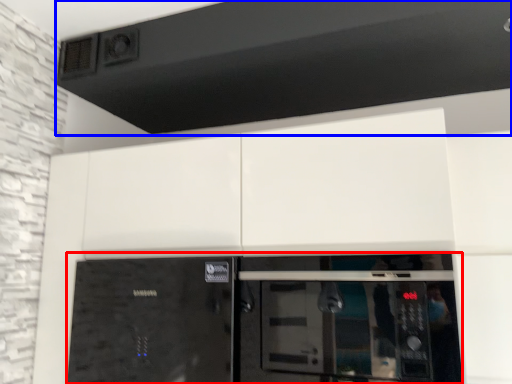
Question: Which point is further to the camera, home appliance (highlighted by a red box) or exhaust hood (highlighted by a blue box)?

Choices:
 (A) home appliance
 (B) exhaust hood

Answer: (B)